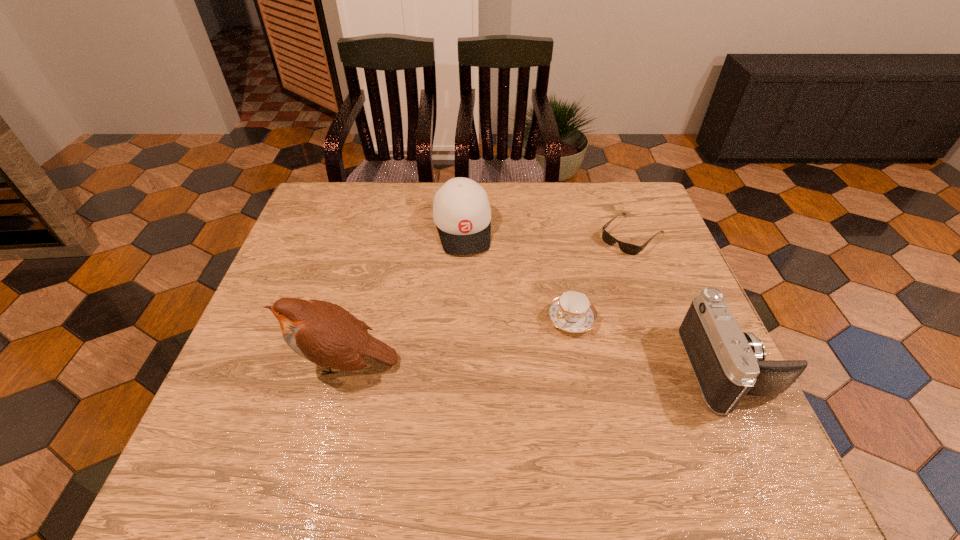
I want to click on the leftmost object, so click(x=324, y=333).

Where is `bird`? The width and height of the screenshot is (960, 540). bird is located at coordinates (324, 333).

The width and height of the screenshot is (960, 540). I want to click on camera, so click(x=728, y=364).

Identify the location of sunglasses. The height and width of the screenshot is (540, 960). (627, 248).

Find the location of a particular element. baseball cap is located at coordinates (461, 211).

This screenshot has width=960, height=540. I want to click on the fourth object from right to left, so click(461, 211).

Identify the location of teacup. The height and width of the screenshot is (540, 960). (572, 312).

Image resolution: width=960 pixels, height=540 pixels. I want to click on the third object from left to right, so click(572, 312).

I want to click on vacant area situated 0.100m at the face of the tallest object, so click(246, 363).

You are a GUI agent. You are given a task and a screenshot of the screen. Output one action in this format:
    pyautogui.click(x=<x>, y=<y>)
    Task: Click on the vacant space located at the face of the tallest object
    The height and width of the screenshot is (540, 960).
    Given the screenshot: What is the action you would take?
    pyautogui.click(x=268, y=363)